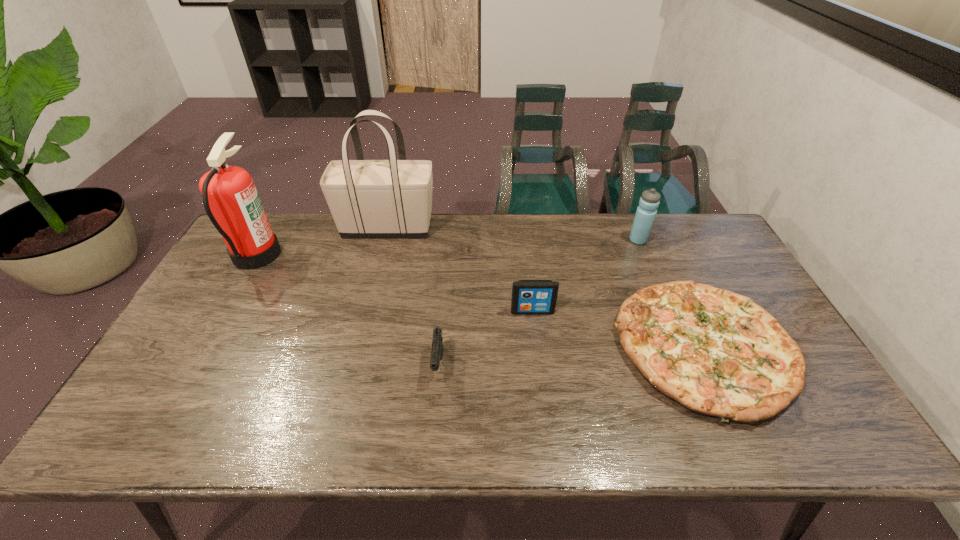
At what (x,y) coordinates should I click in order to perform the action: click on vacant region located 0.070m on the back of the fourth shortest object. Please return your answer as a coordinate pair (x, y). This screenshot has width=960, height=540. Looking at the image, I should click on (631, 222).

Identify the location of blank area located on the front screen of the third shortest object. (543, 407).

Identify the location of free space located 0.060m at the barrel of the pistol. This screenshot has height=540, width=960. (435, 409).

This screenshot has width=960, height=540. In order to click on vacant area situated 0.150m on the left of the pizza in this screenshot , I will do click(561, 347).

Locate an element on the screen. This screenshot has width=960, height=540. shopping bag present at the far edge is located at coordinates (392, 198).

Locate an element on the screen. fire extinguisher located in the far edge section of the desktop is located at coordinates (230, 198).

Where is `water bottle that is positioned at the far edge`? This screenshot has width=960, height=540. water bottle that is positioned at the far edge is located at coordinates (644, 218).

The height and width of the screenshot is (540, 960). I want to click on object located in the near edge section of the desktop, so click(716, 352).

I want to click on object that is at the left edge, so click(230, 198).

Identify the location of object located in the right edge section of the desktop. This screenshot has width=960, height=540. (716, 352).